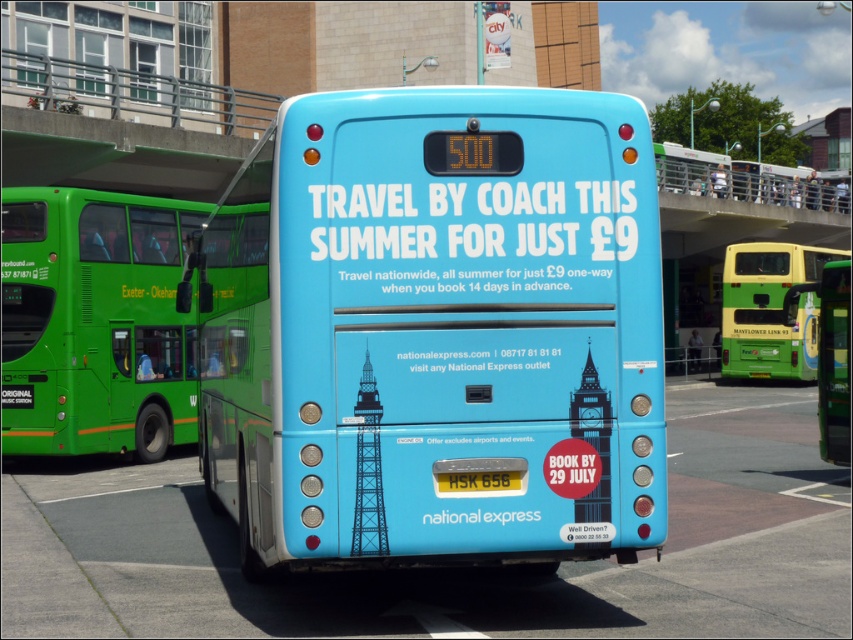
In the scene shown: You are a delivery person who needs to move a 10 meter long container truck between the matte blue bus at center and the green matte bus at left. Can you fit the container truck between them without touching either bus?

The distance between the matte blue bus at center and the green matte bus at left is 12.18 meters. Since the container truck is 10 meters long, there is enough space to fit it between them without touching either bus.

You are a photographer standing at the bus station and want to take a photo of both the matte blue bus at center and the green matte bus at left. Since you want to capture both buses in the frame, which bus should you position closer to the camera to ensure both are fully visible?

The matte blue bus at center is taller than the green matte bus at left. To ensure both are fully visible in the frame, position the taller matte blue bus at center closer to the camera so that its height doesn not block the view of the shorter green matte bus at left.